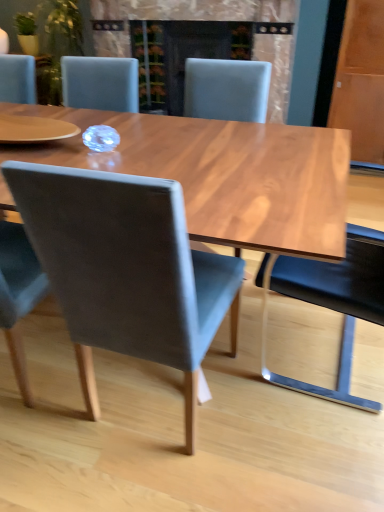
I want to click on free space in front of black leather chair at right, which is the 4th chair from left to right, so click(x=300, y=446).